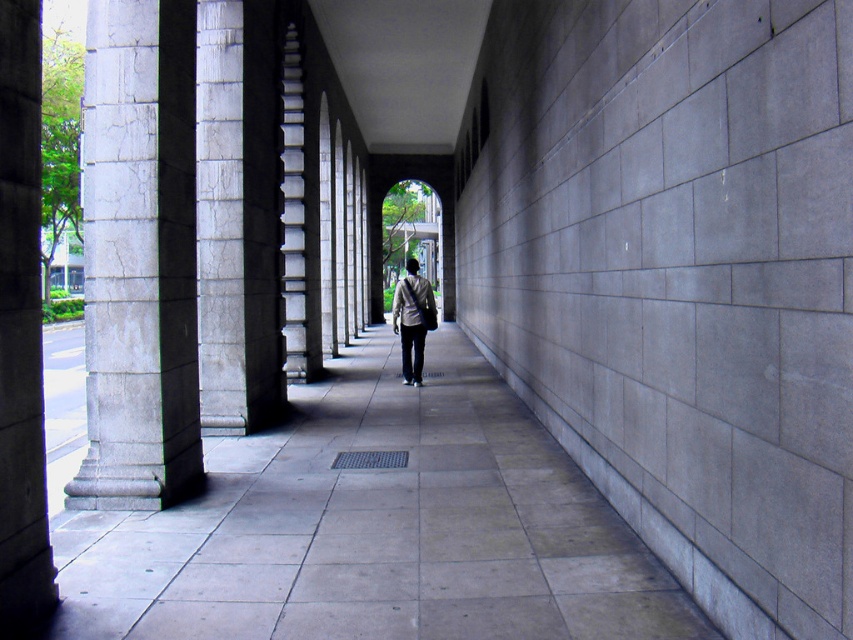
Question: From the image, what is the correct spatial relationship of gray stone column at left in relation to light gray fabric jacket at center?

Choices:
 (A) left
 (B) right

Answer: (A)

Question: Which of these objects is positioned farthest from the gray stone column at left?

Choices:
 (A) gray concrete pillar at left
 (B) gray concrete pavement at center
 (C) light gray fabric jacket at center

Answer: (C)

Question: Which object is positioned farthest from the light gray fabric jacket at center?

Choices:
 (A) gray stone column at left
 (B) gray concrete pillar at left
 (C) gray concrete pavement at center

Answer: (B)

Question: Observing the image, what is the correct spatial positioning of gray concrete pavement at center in reference to light gray fabric jacket at center?

Choices:
 (A) above
 (B) below

Answer: (B)

Question: Which point is closer to the camera?

Choices:
 (A) (393, 308)
 (B) (107, 96)
 (C) (25, 563)

Answer: (C)

Question: Can you confirm if gray concrete pavement at center is bigger than gray stone column at left?

Choices:
 (A) no
 (B) yes

Answer: (B)